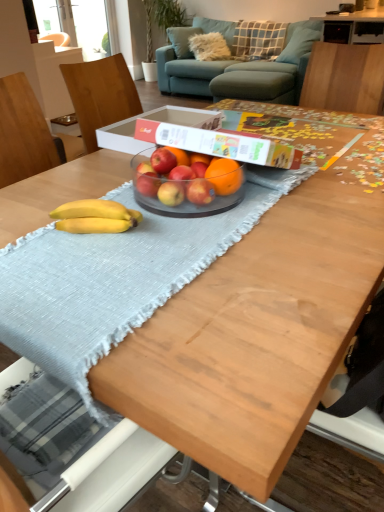
What do you see at coordinates (200, 192) in the screenshot? This screenshot has height=512, width=384. I see `red matte apple at center, marked as the 5th apple in a left-to-right arrangement` at bounding box center [200, 192].

Locate an element on the screen. orange matte at center is located at coordinates (224, 176).

The height and width of the screenshot is (512, 384). Find the location of `wooden chair at upper right`. wooden chair at upper right is located at coordinates (345, 78).

In order to face white cardboard box at center, should I rotate leftwards or rightwards?

A 3.851 degree turn to the left will do.

You are a GUI agent. You are given a task and a screenshot of the screen. Output one action in this format:
    pyautogui.click(x=<x>, y=<y>)
    Task: Click on the blue fabric pillow at upper right, marked as the 1th pillow in a front-to-back arrangement
    Image resolution: width=384 pixels, height=512 pixels.
    Given the screenshot: What is the action you would take?
    pyautogui.click(x=300, y=41)

You are a GUI agent. You are given a task and a screenshot of the screen. Output one action in this format:
    pyautogui.click(x=<x>, y=<y>)
    Task: Click on the red matte apple at center, marked as the 5th apple in a left-to-right arrangement
    The height and width of the screenshot is (512, 384).
    Given the screenshot: What is the action you would take?
    pyautogui.click(x=200, y=192)

Does plaid fabric pillow at upper center, placed as the 1th pillow when sorted from back to front, lie in front of red matte apple at center, marked as the 5th apple in a left-to-right arrangement?

No, the depth of plaid fabric pillow at upper center, placed as the 1th pillow when sorted from back to front, is greater than that of red matte apple at center, marked as the 5th apple in a left-to-right arrangement.

Based on the photo, looking at the image, does plaid fabric pillow at upper center, placed as the 1th pillow when sorted from back to front, seem bigger or smaller compared to red matte apple at center, marked as the 5th apple in a left-to-right arrangement?

plaid fabric pillow at upper center, placed as the 1th pillow when sorted from back to front, is bigger than red matte apple at center, marked as the 5th apple in a left-to-right arrangement.

Is plaid fabric pillow at upper center, the second pillow from the front, taller or shorter than red matte apple at center, marked as the 5th apple in a left-to-right arrangement?

Considering their sizes, plaid fabric pillow at upper center, the second pillow from the front, has more height than red matte apple at center, marked as the 5th apple in a left-to-right arrangement.

Which point is more forward, (266,25) or (195,191)?

The point (195,191) is more forward.

Is transparent glass window screen at upper left surrounded by red matte apple at center, marked as the 5th apple in a left-to-right arrangement?

Actually, transparent glass window screen at upper left is outside red matte apple at center, marked as the 5th apple in a left-to-right arrangement.

Considering the relative sizes of red matte apple at center, marked as the 1th apple in a right-to-left arrangement, and transparent glass window screen at upper left in the image provided, is red matte apple at center, marked as the 1th apple in a right-to-left arrangement, bigger than transparent glass window screen at upper left?

Actually, red matte apple at center, marked as the 1th apple in a right-to-left arrangement, might be smaller than transparent glass window screen at upper left.

In the image, is red matte apple at center, marked as the 1th apple in a right-to-left arrangement, positioned in front of or behind transparent glass window screen at upper left?

red matte apple at center, marked as the 1th apple in a right-to-left arrangement, is in front of transparent glass window screen at upper left.

From the image's perspective, which one is positioned lower, red matte apple at center, marked as the 5th apple in a left-to-right arrangement, or transparent glass window screen at upper left?

red matte apple at center, marked as the 5th apple in a left-to-right arrangement, is shown below in the image.

Which is closer to the camera, (169, 163) or (79, 221)?

Point (169, 163).

Does red matte apple at center, the fourth apple viewed from the right, have a greater height compared to yellow matte bananas at center?

No.

Is red matte apple at center, the fourth apple viewed from the right, oriented towards yellow matte bananas at center?

Yes, red matte apple at center, the fourth apple viewed from the right, faces towards yellow matte bananas at center.

Consider the image. Can we say red matte apple at center, the fourth apple viewed from the right, lies outside yellow matte bananas at center?

Yes, red matte apple at center, the fourth apple viewed from the right, is located beyond the bounds of yellow matte bananas at center.

Is red matte apple at center, which is the 2th apple in right-to-left order, far away from red matte apple at center, which is the second apple from left to right?

Actually, red matte apple at center, which is the 2th apple in right-to-left order, and red matte apple at center, which is the second apple from left to right, are a little close together.

From the image's perspective, is red matte apple at center, acting as the fourth apple starting from the left, located beneath red matte apple at center, the fourth apple viewed from the right?

Yes.

From the picture: Who is smaller, red matte apple at center, acting as the fourth apple starting from the left, or red matte apple at center, the fourth apple viewed from the right?

red matte apple at center, acting as the fourth apple starting from the left, is smaller.

Does red matte apple at center, acting as the 5th apple starting from the right, have a lesser width compared to red matte apple at center, which is the 2th apple in right-to-left order?

Yes, red matte apple at center, acting as the 5th apple starting from the right, is thinner than red matte apple at center, which is the 2th apple in right-to-left order.

Is red matte apple at center, which is the 1th apple from left to right, in front of or behind red matte apple at center, which is the 2th apple in right-to-left order, in the image?

red matte apple at center, which is the 1th apple from left to right, is behind red matte apple at center, which is the 2th apple in right-to-left order.

Looking at this image, is red matte apple at center, which is the 1th apple from left to right, to the right of red matte apple at center, which is the 2th apple in right-to-left order, from the viewer's perspective?

No, red matte apple at center, which is the 1th apple from left to right, is not to the right of red matte apple at center, which is the 2th apple in right-to-left order.

From the image's perspective, between red matte apple at center, which is the 1th apple from left to right, and red matte apple at center, acting as the fourth apple starting from the left, which one is located above?

red matte apple at center, acting as the fourth apple starting from the left, is shown above in the image.

Which object is further away from the camera, plaid fabric pillow at upper center, placed as the 1th pillow when sorted from back to front, or red matte apple at center, which is the second apple from left to right?

plaid fabric pillow at upper center, placed as the 1th pillow when sorted from back to front, is further away from the camera.

Where is `the 2nd pillow behind the red matte apple at center, the fourth apple viewed from the right`? the 2nd pillow behind the red matte apple at center, the fourth apple viewed from the right is located at coordinates click(x=258, y=40).

Considering the relative sizes of plaid fabric pillow at upper center, the second pillow from the front, and red matte apple at center, which is the second apple from left to right, in the image provided, is plaid fabric pillow at upper center, the second pillow from the front, taller than red matte apple at center, which is the second apple from left to right,?

Yes.

Is plaid fabric pillow at upper center, placed as the 1th pillow when sorted from back to front, positioned with its back to red matte apple at center, which is the second apple from left to right?

No, plaid fabric pillow at upper center, placed as the 1th pillow when sorted from back to front, is not facing the opposite direction of red matte apple at center, which is the second apple from left to right.

Which of these two, transparent glass window screen at upper left or red matte apple at center, which is the 1th apple from left to right, stands taller?

With more height is transparent glass window screen at upper left.

Considering the relative positions of transparent glass window screen at upper left and red matte apple at center, acting as the 5th apple starting from the right, in the image provided, is transparent glass window screen at upper left to the left of red matte apple at center, acting as the 5th apple starting from the right, from the viewer's perspective?

Yes.

How different are the orientations of transparent glass window screen at upper left and red matte apple at center, which is the 1th apple from left to right, in degrees?

The facing directions of transparent glass window screen at upper left and red matte apple at center, which is the 1th apple from left to right, are 95.5 degrees apart.

Between point (49, 4) and point (144, 192), which one is positioned behind?

The point (49, 4) is more distant.

In order to click on pillow that is the 2nd object located above the red matte apple at center, marked as the 1th apple in a right-to-left arrangement (from the image's perspective) in this screenshot , I will do `click(258, 40)`.

Identify the location of window screen that is under the red matte apple at center, marked as the 5th apple in a left-to-right arrangement (from a real-world perspective). (76, 24).

Based on their spatial positions, is wooden chair at upper right or plaid fabric pillow at upper center, placed as the 1th pillow when sorted from back to front, closer to red matte apple at center, acting as the 5th apple starting from the right?

wooden chair at upper right is closer to red matte apple at center, acting as the 5th apple starting from the right.

Consider the image. When comparing their distances from red matte apple at center, acting as the fourth apple starting from the left, does red matte apple at center, the fourth apple viewed from the right, or white cardboard box at center seem closer?

Among the two, red matte apple at center, the fourth apple viewed from the right, is located nearer to red matte apple at center, acting as the fourth apple starting from the left.

Which object lies further to the anchor point orange matte at center, white cardboard box at center or transparent glass window screen at upper left?

Based on the image, transparent glass window screen at upper left appears to be further to orange matte at center.

Which object lies nearer to the anchor point teal fabric couch at upper center, yellow matte apple at center, placed as the 3th apple when sorted from left to right, or red matte apple at center, acting as the 5th apple starting from the right?

The object closer to teal fabric couch at upper center is red matte apple at center, acting as the 5th apple starting from the right.

From the image, which object appears to be nearer to yellow matte bananas at center, teal fabric couch at upper center or orange matte at center?

The object closer to yellow matte bananas at center is orange matte at center.

Considering their positions, is red matte apple at center, marked as the 5th apple in a left-to-right arrangement, positioned further to blue fabric pillow at upper right, marked as the 1th pillow in a front-to-back arrangement, than red matte apple at center, which is the second apple from left to right?

red matte apple at center, marked as the 5th apple in a left-to-right arrangement, lies further to blue fabric pillow at upper right, marked as the 1th pillow in a front-to-back arrangement, than the other object.

Estimate the real-world distances between objects in this image. Which object is closer to plaid fabric pillow at upper center, placed as the 1th pillow when sorted from back to front, teal fabric couch at upper center or red matte apple at center, which is the 2th apple in right-to-left order?

Based on the image, teal fabric couch at upper center appears to be nearer to plaid fabric pillow at upper center, placed as the 1th pillow when sorted from back to front.

Based on their spatial positions, is blue fabric pillow at upper right, the 2th pillow in the back-to-front sequence, or plaid fabric pillow at upper center, the second pillow from the front, closer to red matte apple at center, marked as the 5th apple in a left-to-right arrangement?

The object closer to red matte apple at center, marked as the 5th apple in a left-to-right arrangement, is blue fabric pillow at upper right, the 2th pillow in the back-to-front sequence.

I want to click on orange positioned between yellow matte bananas at center and plaid fabric pillow at upper center, placed as the 1th pillow when sorted from back to front, from near to far, so click(224, 176).

Where is `apple positioned between red matte apple at center, acting as the 5th apple starting from the right, and transparent glass window screen at upper left from near to far`? apple positioned between red matte apple at center, acting as the 5th apple starting from the right, and transparent glass window screen at upper left from near to far is located at coordinates (163, 161).

This screenshot has width=384, height=512. Identify the location of chair located between red matte apple at center, which is the 1th apple from left to right, and plaid fabric pillow at upper center, the second pillow from the front, in the depth direction. (345, 78).

Identify the location of cardboard box between yellow matte apple at center, the 3th apple in the right-to-left sequence, and transparent glass window screen at upper left in the front-back direction. The height and width of the screenshot is (512, 384). (195, 137).